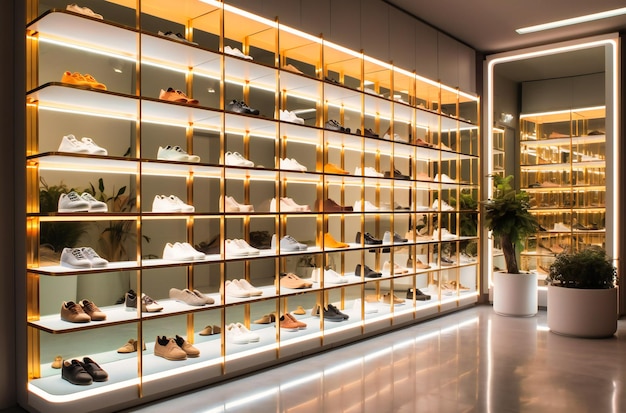
The image size is (626, 413). What are the coordinates of `shelf` in the screenshot? It's located at (68, 394), (58, 327), (54, 272), (52, 216), (63, 151), (59, 89), (95, 21).